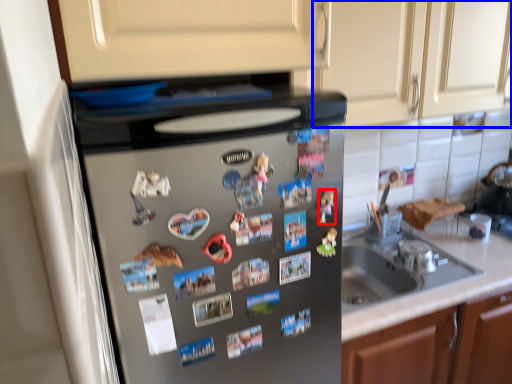
Question: Among these objects, which one is nearest to the camera, toy (highlighted by a red box) or cabinetry (highlighted by a blue box)?

Choices:
 (A) toy
 (B) cabinetry

Answer: (A)